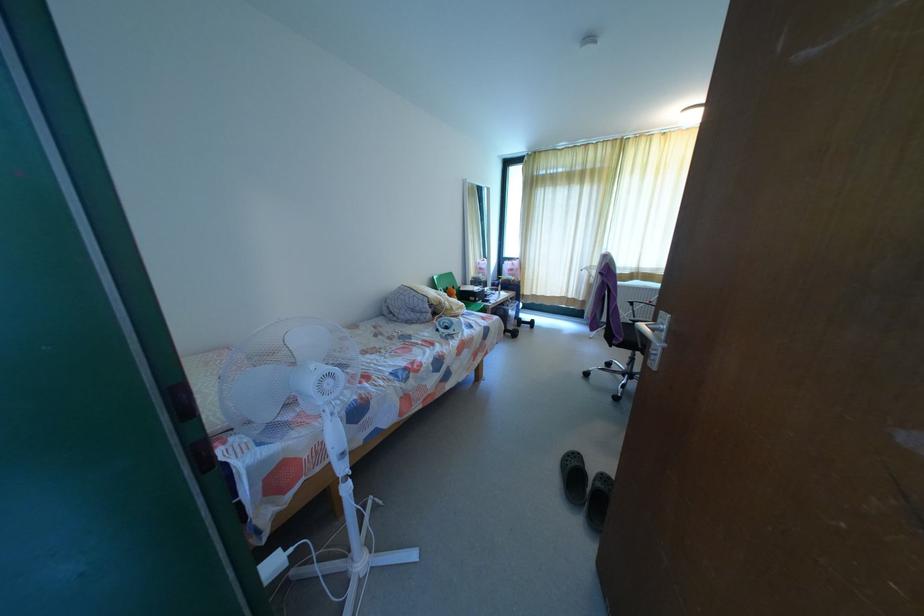
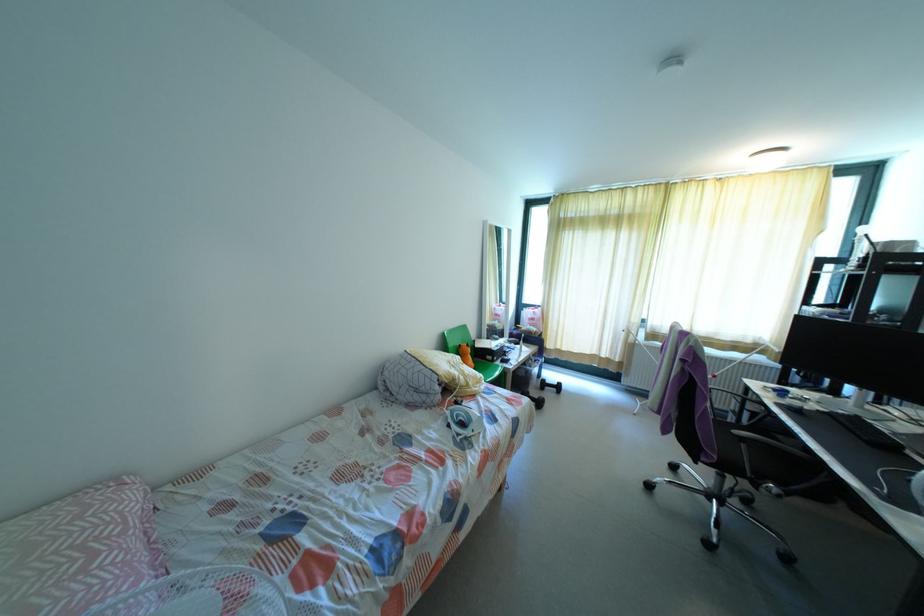
Locate, in the second image, the point that corresponds to point (450, 274) in the first image.

(464, 328)